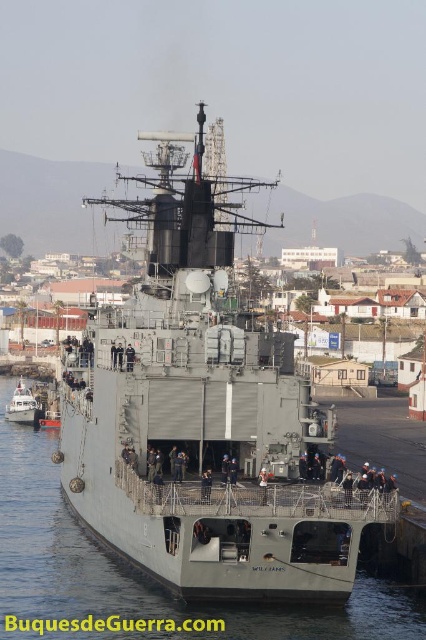
Question: Is gray matte ship at center below white matte boat at lower left?

Choices:
 (A) no
 (B) yes

Answer: (A)

Question: Can you confirm if gray metallic water at lower center is wider than white matte boat at lower left?

Choices:
 (A) yes
 (B) no

Answer: (A)

Question: Which of the following is the farthest from the observer?

Choices:
 (A) white matte boat at lower left
 (B) gray matte ship at center
 (C) gray metallic water at lower center

Answer: (A)

Question: Considering the relative positions of gray matte ship at center and gray metallic water at lower center in the image provided, where is gray matte ship at center located with respect to gray metallic water at lower center?

Choices:
 (A) right
 (B) left

Answer: (B)

Question: Which object appears farthest from the camera in this image?

Choices:
 (A) gray metallic water at lower center
 (B) white matte boat at lower left
 (C) gray matte ship at center

Answer: (B)

Question: Which is farther from the gray metallic water at lower center?

Choices:
 (A) gray matte ship at center
 (B) white matte boat at lower left

Answer: (B)